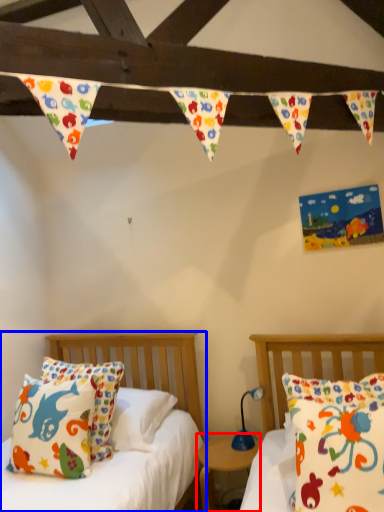
Question: Which object appears closest to the camera in this image, nightstand (highlighted by a red box) or bed (highlighted by a blue box)?

Choices:
 (A) nightstand
 (B) bed

Answer: (B)